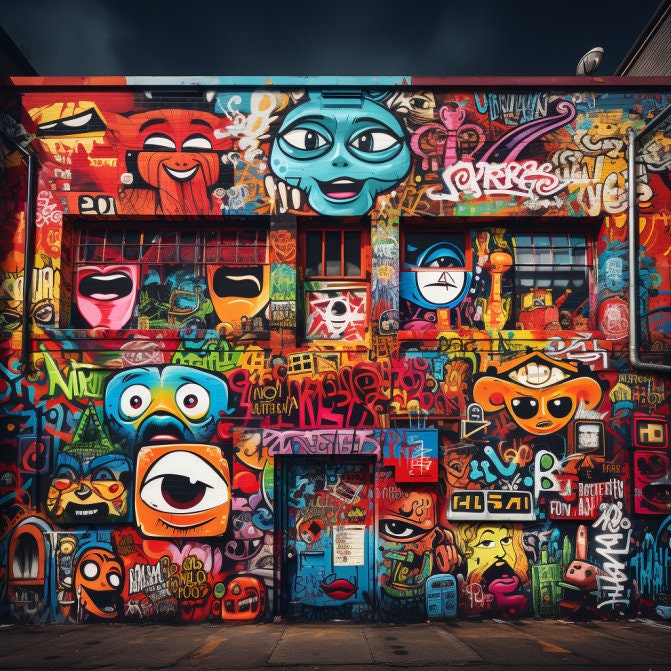
The width and height of the screenshot is (671, 671). Find the location of `notice on door`. notice on door is located at coordinates (358, 548).